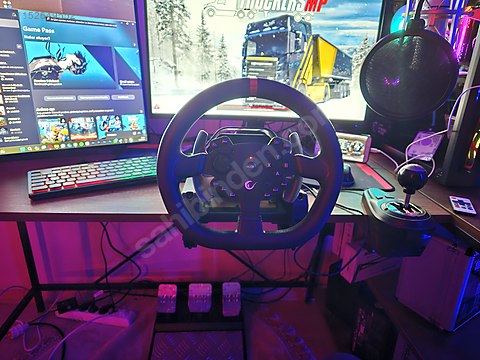
Locate an element on the screen. The image size is (480, 360). white device on right table is located at coordinates (464, 206).